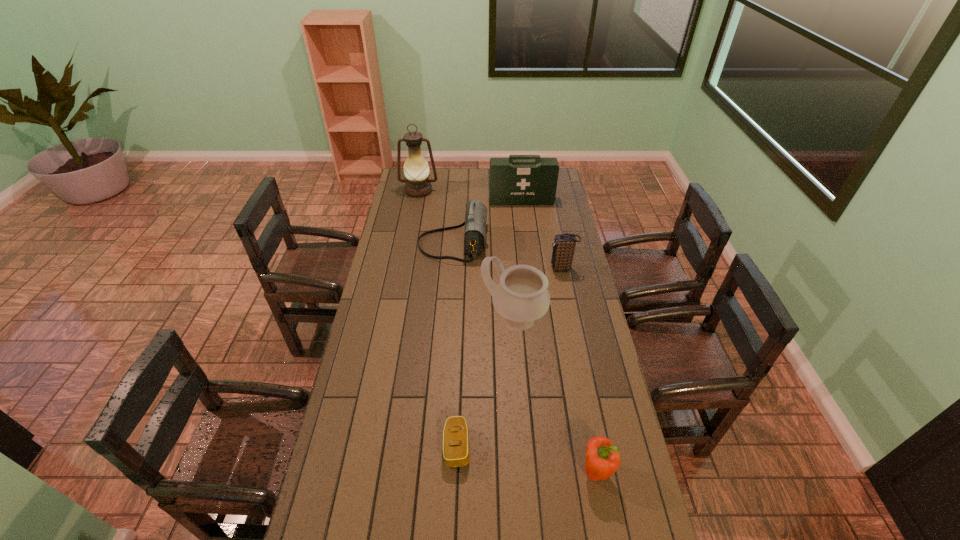
The image size is (960, 540). What are the coordinates of `the first-aid kit that is at the right edge` in the screenshot? It's located at (520, 179).

You are a GUI agent. You are given a task and a screenshot of the screen. Output one action in this format:
    pyautogui.click(x=<x>, y=<y>)
    Task: Click on the clutch bag positioned at the right edge
    This screenshot has width=960, height=540.
    Given the screenshot: What is the action you would take?
    pyautogui.click(x=564, y=244)

At what (x,y) coordinates should I click in order to perform the action: click on pepper situated at the right edge. Please return your answer as a coordinate pair (x, y). This screenshot has height=540, width=960. Looking at the image, I should click on (x=602, y=458).

Where is `object present at the far left corner`? This screenshot has height=540, width=960. object present at the far left corner is located at coordinates (416, 169).

In the image, there is a desktop. At what (x,y) coordinates should I click in order to perform the action: click on blank space at the far edge. Please return your answer as a coordinate pair (x, y). Image resolution: width=960 pixels, height=540 pixels. Looking at the image, I should click on (432, 176).

Identify the location of vacant space at the left edge of the desktop. The height and width of the screenshot is (540, 960). (356, 392).

Image resolution: width=960 pixels, height=540 pixels. What are the coordinates of `free point at the right edge` in the screenshot? It's located at (567, 329).

The height and width of the screenshot is (540, 960). Identify the location of empty space that is in between the first-aid kit and the second shortest object. (559, 336).

At what (x,y) coordinates should I click in order to perform the action: click on unoccupied area between the pottery and the first-aid kit. Please return your answer as a coordinate pair (x, y). Looking at the image, I should click on (517, 260).

This screenshot has height=540, width=960. I want to click on free space between the shoulder bag and the first-aid kit, so click(488, 222).